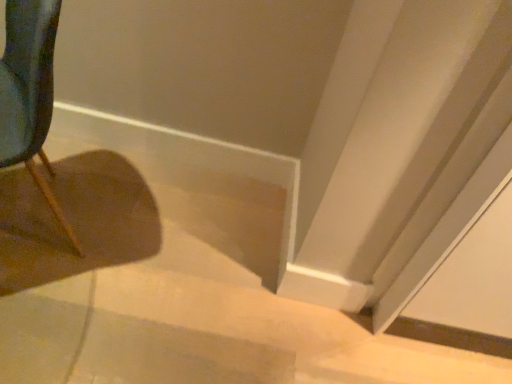
The height and width of the screenshot is (384, 512). Identify the location of vacant location behind matte brown chair at left. (103, 167).